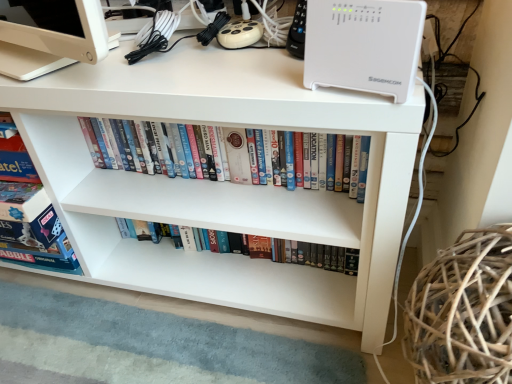
Describe the element at coordinates (463, 312) in the screenshot. I see `brown woven basket at lower right` at that location.

You are a GUI agent. You are given a task and a screenshot of the screen. Output one action in this format:
    pyautogui.click(x=<x>, y=<y>)
    Task: Click on the white plastic dvds at center, the second book from the bottom
    Image resolution: width=512 pixels, height=384 pixels.
    Given the screenshot: What is the action you would take?
    pyautogui.click(x=347, y=161)

The width and height of the screenshot is (512, 384). Describe the element at coordinates (223, 182) in the screenshot. I see `white matte desk at upper center` at that location.

Identify the location of brown woven basket at lower right. (463, 312).

Considering the sizes of objects brown woven basket at lower right and white glossy bookshelf at center, the 1th book ordered from the bottom, in the image provided, who is bigger, brown woven basket at lower right or white glossy bookshelf at center, the 1th book ordered from the bottom,?

brown woven basket at lower right is bigger.

Does brown woven basket at lower right have a greater height compared to white glossy bookshelf at center, the 1th book ordered from the bottom?

Correct, brown woven basket at lower right is much taller as white glossy bookshelf at center, the 1th book ordered from the bottom.

Which is closer to the camera, (447, 332) or (130, 219)?

Point (447, 332) appears to be closer to the viewer than point (130, 219).

From the image's perspective, is brown woven basket at lower right below white plastic dvds at center, the second book from the bottom?

Yes, from the image's perspective, brown woven basket at lower right is below white plastic dvds at center, the second book from the bottom.

Is brown woven basket at lower right not near white plastic dvds at center, the second book from the bottom?

brown woven basket at lower right is near white plastic dvds at center, the second book from the bottom, not far away.

In the image, is brown woven basket at lower right positioned in front of or behind white plastic dvds at center, the second book from the bottom?

Visually, brown woven basket at lower right is located in front of white plastic dvds at center, the second book from the bottom.

Which object is positioned more to the right, brown woven basket at lower right or white plastic dvds at center, the second book from the bottom?

From the viewer's perspective, brown woven basket at lower right appears more on the right side.

From a real-world perspective, between white matte desk at upper center and brown woven basket at lower right, who is vertically higher?

In real-world perspective, brown woven basket at lower right is above.

Who is smaller, white matte desk at upper center or brown woven basket at lower right?

With smaller size is brown woven basket at lower right.

How much distance is there between white matte desk at upper center and brown woven basket at lower right?

A distance of 14.17 inches exists between white matte desk at upper center and brown woven basket at lower right.

Is white matte desk at upper center to the right of brown woven basket at lower right from the viewer's perspective?

In fact, white matte desk at upper center is to the left of brown woven basket at lower right.

Based on the photo, which object is thinner, white plastic dvds at center, the second book from the bottom, or white matte desk at upper center?

Thinner between the two is white plastic dvds at center, the second book from the bottom.

Consider the image. From the image's perspective, is white plastic dvds at center, the second book from the bottom, positioned above or below white matte desk at upper center?

From the image's perspective, white plastic dvds at center, the second book from the bottom, appears above white matte desk at upper center.

I want to click on book above the white matte desk at upper center (from the image's perspective), so click(x=347, y=161).

Considering the relative positions of white plastic dvds at center, arranged as the first book when viewed from the top, and white matte desk at upper center in the image provided, is white plastic dvds at center, arranged as the first book when viewed from the top, in front of white matte desk at upper center?

No, white plastic dvds at center, arranged as the first book when viewed from the top, is behind white matte desk at upper center.

Where is `book that is the 1st object to the right of the white matte desk at upper center, starting at the anchor`? Image resolution: width=512 pixels, height=384 pixels. book that is the 1st object to the right of the white matte desk at upper center, starting at the anchor is located at coordinates (347, 161).

Which of these two, white matte desk at upper center or white plastic dvds at center, arranged as the first book when viewed from the top, is bigger?

white matte desk at upper center.

From a real-world perspective, who is located lower, white matte desk at upper center or white plastic dvds at center, arranged as the first book when viewed from the top?

From a 3D spatial view, white matte desk at upper center is below.

In order to click on basket that is in front of the white matte desk at upper center in this screenshot , I will do `click(463, 312)`.

Considering the sizes of objects brown woven basket at lower right and white matte desk at upper center in the image provided, who is thinner, brown woven basket at lower right or white matte desk at upper center?

With smaller width is brown woven basket at lower right.

Would you say brown woven basket at lower right is a long distance from white matte desk at upper center?

That's not correct — brown woven basket at lower right is a little close to white matte desk at upper center.

From a real-world perspective, relative to white matte desk at upper center, is brown woven basket at lower right vertically above or below?

brown woven basket at lower right is above white matte desk at upper center.

From a real-world perspective, is white matte desk at upper center on top of white glossy bookshelf at center, the 2th book viewed from the top?

Yes, from a real-world perspective, white matte desk at upper center is on top of white glossy bookshelf at center, the 2th book viewed from the top.

Between point (231, 264) and point (294, 253), which one is positioned in front?

The point (294, 253) is closer to the camera.

Is white matte desk at upper center to the right of white glossy bookshelf at center, the 1th book ordered from the bottom, from the viewer's perspective?

No, white matte desk at upper center is not to the right of white glossy bookshelf at center, the 1th book ordered from the bottom.

Identify the location of basket on the right of white glossy bookshelf at center, the 2th book viewed from the top. (463, 312).

Locate an element on the screen. Image resolution: width=512 pixels, height=384 pixels. the 1st book behind the brown woven basket at lower right, starting your count from the anchor is located at coordinates (347, 161).

Looking at the image, which one is located closer to white plastic dvds at center, arranged as the first book when viewed from the top, white glossy bookshelf at center, the 2th book viewed from the top, or white matte desk at upper center?

white matte desk at upper center is positioned closer to the anchor white plastic dvds at center, arranged as the first book when viewed from the top.

Considering their positions, is white matte desk at upper center positioned closer to white plastic dvds at center, the second book from the bottom, than brown woven basket at lower right?

The object closer to white plastic dvds at center, the second book from the bottom, is white matte desk at upper center.

When comparing their distances from white glossy bookshelf at center, the 1th book ordered from the bottom, does white matte desk at upper center or white plastic dvds at center, arranged as the first book when viewed from the top, seem closer?

Based on the image, white matte desk at upper center appears to be nearer to white glossy bookshelf at center, the 1th book ordered from the bottom.

Considering their positions, is white plastic dvds at center, arranged as the first book when viewed from the top, positioned closer to white glossy bookshelf at center, the 1th book ordered from the bottom, than brown woven basket at lower right?

white plastic dvds at center, arranged as the first book when viewed from the top, is positioned closer to the anchor white glossy bookshelf at center, the 1th book ordered from the bottom.

Based on their spatial positions, is white plastic dvds at center, the second book from the bottom, or white matte desk at upper center closer to brown woven basket at lower right?

white plastic dvds at center, the second book from the bottom, is positioned closer to the anchor brown woven basket at lower right.

Considering their positions, is white plastic dvds at center, the second book from the bottom, positioned further to brown woven basket at lower right than white glossy bookshelf at center, the 1th book ordered from the bottom?

Among the two, white glossy bookshelf at center, the 1th book ordered from the bottom, is located further to brown woven basket at lower right.

Based on their spatial positions, is brown woven basket at lower right or white glossy bookshelf at center, the 2th book viewed from the top, further from white plastic dvds at center, the second book from the bottom?

Based on the image, brown woven basket at lower right appears to be further to white plastic dvds at center, the second book from the bottom.

Estimate the real-world distances between objects in this image. Which object is closer to white plastic dvds at center, the second book from the bottom, white matte desk at upper center or white glossy bookshelf at center, the 2th book viewed from the top?

white matte desk at upper center is closer to white plastic dvds at center, the second book from the bottom.

The width and height of the screenshot is (512, 384). I want to click on desk positioned between brown woven basket at lower right and white glossy bookshelf at center, the 1th book ordered from the bottom, from near to far, so click(x=223, y=182).

The width and height of the screenshot is (512, 384). What are the coordinates of `book between brown woven basket at lower right and white glossy bookshelf at center, the 1th book ordered from the bottom, in the front-back direction` in the screenshot? It's located at (347, 161).

Find the location of `book between white matte desk at upper center and white glossy bookshelf at center, the 2th book viewed from the top, in the front-back direction`. book between white matte desk at upper center and white glossy bookshelf at center, the 2th book viewed from the top, in the front-back direction is located at coordinates (347, 161).